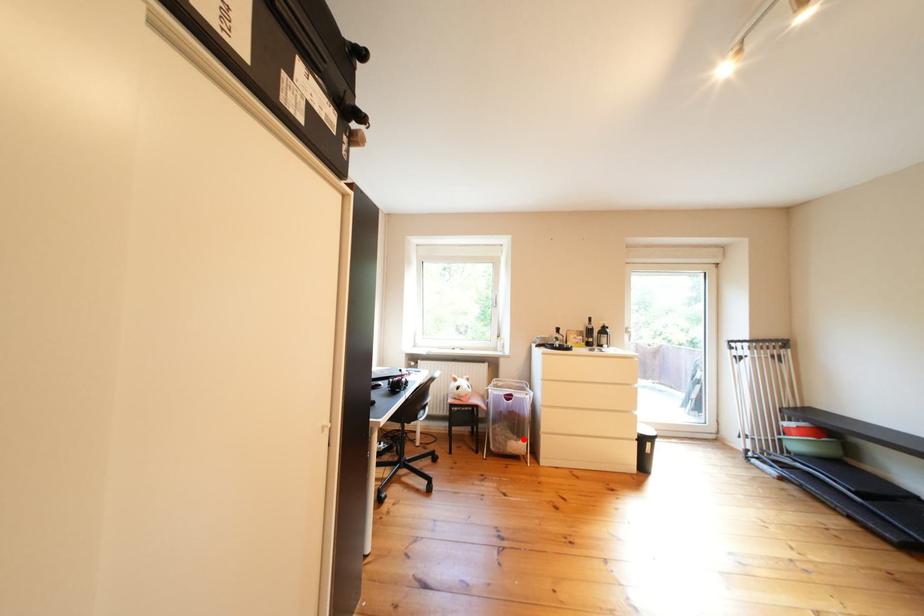
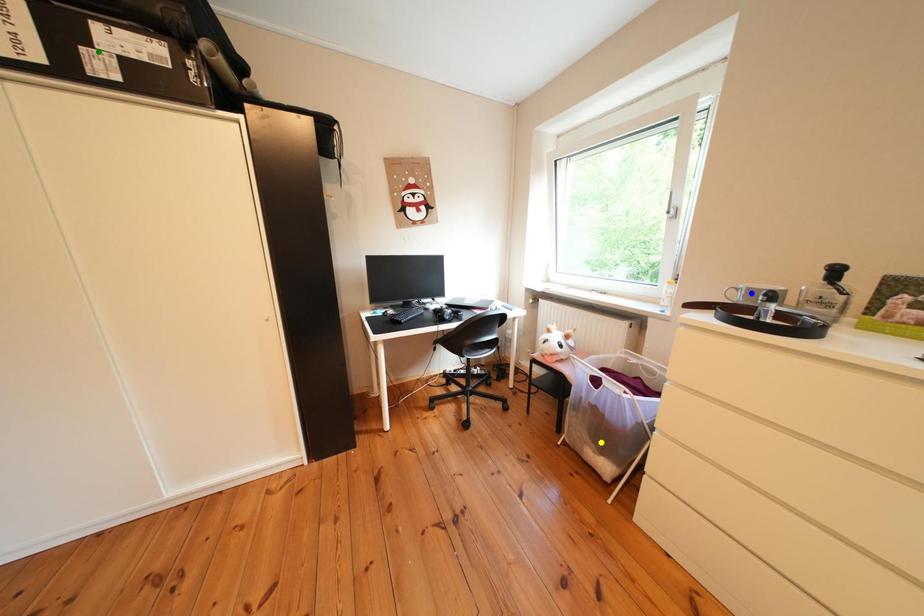
Question: I am providing you with two images of the same scene from different viewpoints. A red point is marked on the first image. You are given multiple points on the second image. Which point in image 2 is actually the same real-world point as the red point in image 1?

Choices:
 (A) blue point
 (B) green point
 (C) yellow point

Answer: (C)